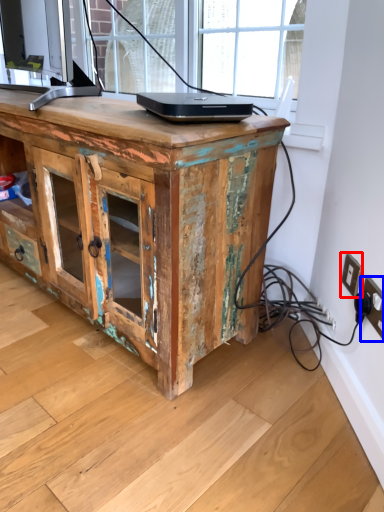
Question: Which of the following is the closest to the observer, electric outlet (highlighted by a red box) or electric outlet (highlighted by a blue box)?

Choices:
 (A) electric outlet
 (B) electric outlet

Answer: (B)